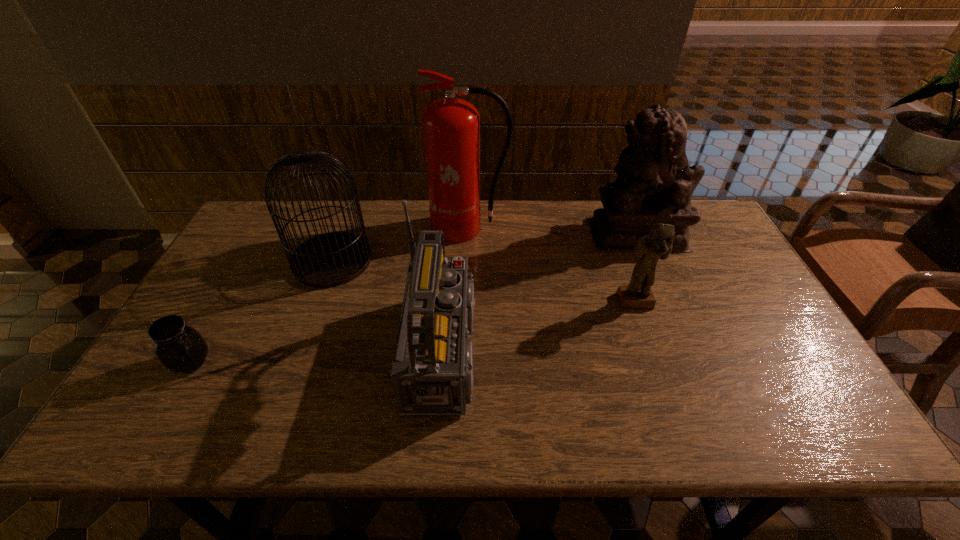
Locate an element on the screen. The height and width of the screenshot is (540, 960). free space between the birdcage and the radio receiver is located at coordinates (393, 306).

The image size is (960, 540). What are the coordinates of `vacant region between the fire extinguisher and the fifth tallest object` in the screenshot? It's located at (553, 265).

Find the location of `free spot between the radio receiver and the jar`. free spot between the radio receiver and the jar is located at coordinates (323, 356).

Identify the location of vacant space that is in between the birdcage and the second shortest object. [x=484, y=281].

Identify the location of empty space between the leftmost object and the birdcage. (262, 311).

Locate an element on the screen. vacant space that's between the fifth object from right to left and the jar is located at coordinates (262, 311).

At what (x,y) coordinates should I click in order to perform the action: click on free space between the second object from left to right and the jar. Please return your answer as a coordinate pair (x, y). Looking at the image, I should click on (262, 311).

Find the location of a particular element. object that stands as the second closest to the sculpture is located at coordinates (451, 126).

This screenshot has height=540, width=960. What are the coordinates of `object that is the third closest to the radio receiver` in the screenshot? It's located at (657, 245).

Where is `blank space that satisfies the following two spatial constraints: 1. towards the nozzle of the tallest object; 2. on the lid of the jar`? The height and width of the screenshot is (540, 960). blank space that satisfies the following two spatial constraints: 1. towards the nozzle of the tallest object; 2. on the lid of the jar is located at coordinates (466, 362).